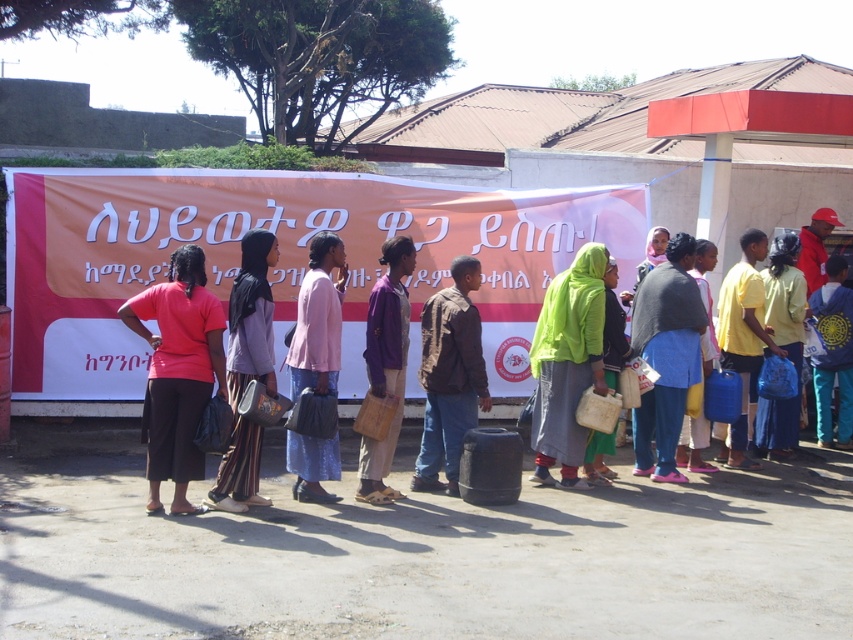
Does brown leather jacket at center have a lesser height compared to yellow matte water at right?

Yes.

Who is lower down, brown leather jacket at center or yellow matte water at right?

brown leather jacket at center is lower down.

Is point (463, 253) closer to viewer compared to point (767, 330)?

No, (463, 253) is further to viewer.

Locate an element on the screen. The height and width of the screenshot is (640, 853). brown leather jacket at center is located at coordinates (450, 376).

Is point (692, 284) closer to camera compared to point (463, 381)?

No, it is behind (463, 381).

Does blue fabric bag at center appear on the left side of brown leather jacket at center?

Incorrect, blue fabric bag at center is not on the left side of brown leather jacket at center.

The image size is (853, 640). Describe the element at coordinates (666, 356) in the screenshot. I see `blue fabric bag at center` at that location.

Where is `blue fabric bag at center`? This screenshot has height=640, width=853. blue fabric bag at center is located at coordinates (666, 356).

From the picture: Does blue fabric bag at center lie in front of pink fabric dress at center?

No, blue fabric bag at center is behind pink fabric dress at center.

Which is behind, point (645, 445) or point (332, 381)?

Positioned behind is point (645, 445).

The width and height of the screenshot is (853, 640). In order to click on blue fabric bag at center in this screenshot , I will do `click(666, 356)`.